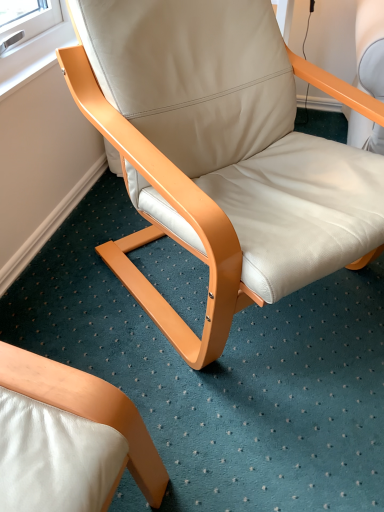
You are a GUI agent. You are given a task and a screenshot of the screen. Output one action in this format:
    pyautogui.click(x=<x>, y=<y>)
    Task: Click on the free spot below beige leather chair at center (from a real-world perspective)
    
    Given the screenshot: What is the action you would take?
    pyautogui.click(x=202, y=297)